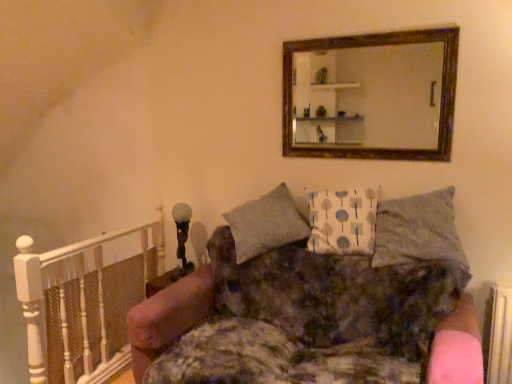
The height and width of the screenshot is (384, 512). Find the location of `free space above wooden frame mirror at upper center (from a real-world perspective)`. free space above wooden frame mirror at upper center (from a real-world perspective) is located at coordinates (362, 32).